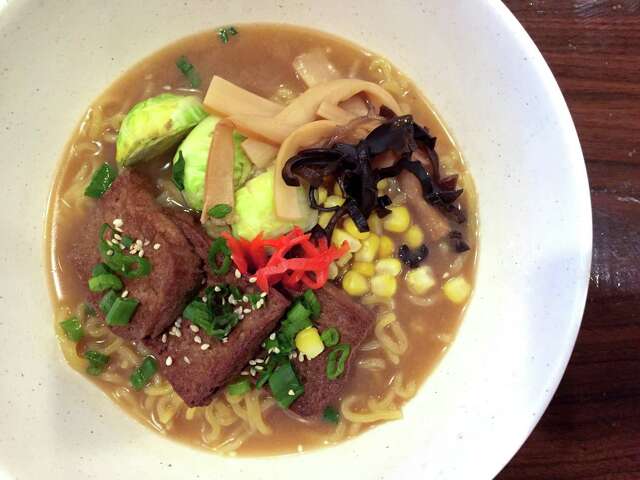
Locate an element on the screen. The image size is (640, 480). white soup bowl with wide rim is located at coordinates (438, 37).